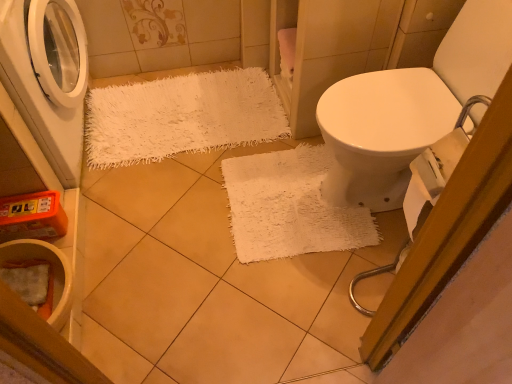
Question: Looking at the image, does white matte washing machine at left seem bigger or smaller compared to white ceramic toilet bowl at lower left?

Choices:
 (A) small
 (B) big

Answer: (B)

Question: From a real-world perspective, relative to white ceramic toilet bowl at lower left, is white matte washing machine at left vertically above or below?

Choices:
 (A) above
 (B) below

Answer: (A)

Question: Based on their relative distances, which object is nearer to the white shaggy rug at upper left?

Choices:
 (A) white ceramic toilet bowl at lower left
 (B) white matte washing machine at left

Answer: (B)

Question: Which of these objects is positioned farthest from the white matte washing machine at left?

Choices:
 (A) white ceramic toilet bowl at lower left
 (B) white shaggy rug at upper left

Answer: (A)